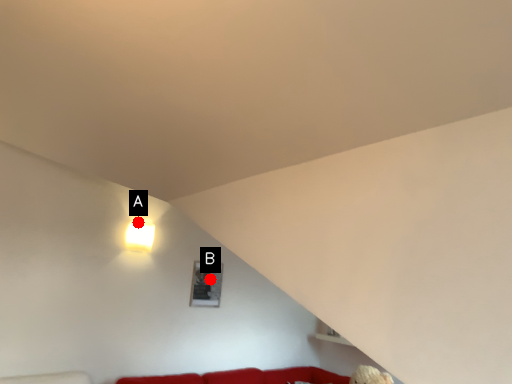
Question: Two points are circled on the image, labeled by A and B beside each circle. Which of the following is the closest to the observer?

Choices:
 (A) A is closer
 (B) B is closer

Answer: (A)